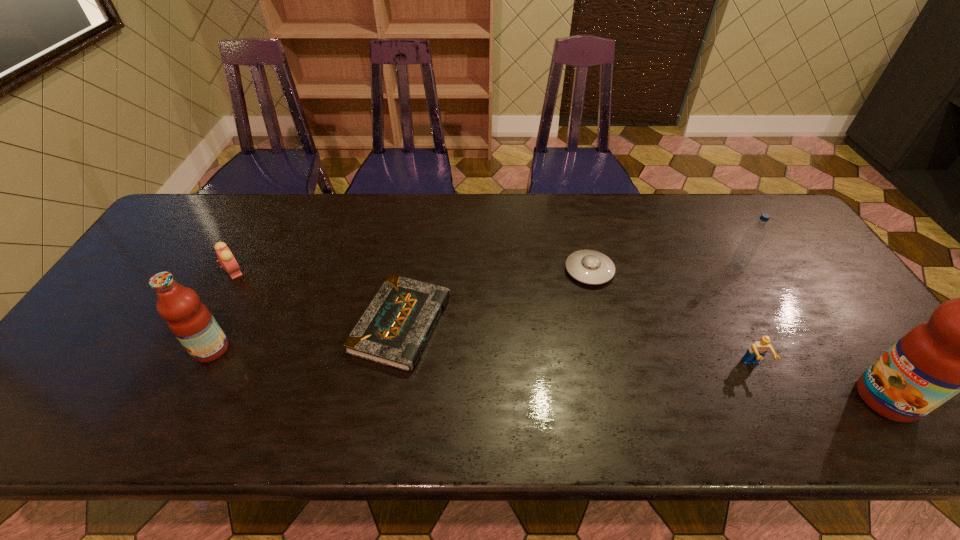
You are a GUI agent. You are given a task and a screenshot of the screen. Output one action in this format:
    pyautogui.click(x=<x>, y=<y>)
    Task: Click on the blank area located on the left of the shortest object
    The height and width of the screenshot is (540, 960).
    Given the screenshot: What is the action you would take?
    pyautogui.click(x=217, y=324)

Where is `vacant area located 0.080m on the face of the alarm clock`? vacant area located 0.080m on the face of the alarm clock is located at coordinates (275, 272).

I want to click on fruit juice situated at the near edge, so click(959, 349).

The image size is (960, 540). Identify the location of notebook positioned at the near edge. (393, 331).

Where is `Lego situated at the near edge`? The image size is (960, 540). Lego situated at the near edge is located at coordinates (758, 350).

The width and height of the screenshot is (960, 540). What are the coordinates of `object that is at the right edge` in the screenshot? It's located at (959, 349).

In order to click on object that is at the near right corner in this screenshot , I will do `click(959, 349)`.

Find the location of a particular element. vacant region at the far edge of the desktop is located at coordinates (552, 239).

Identify the location of free space at the near edge of the desktop. (671, 383).

The width and height of the screenshot is (960, 540). What are the coordinates of `free space at the right edge of the desktop` in the screenshot? It's located at (866, 335).